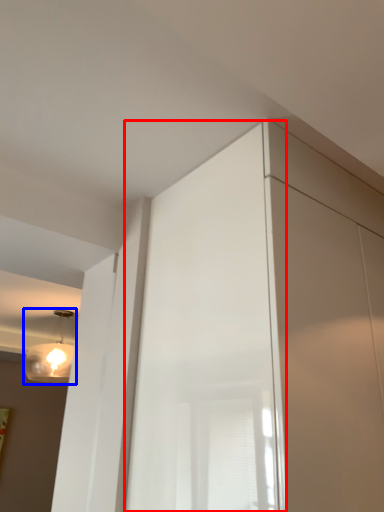
Question: Which of the following is the farthest to the observer, screen door (highlighted by a red box) or lamp (highlighted by a blue box)?

Choices:
 (A) screen door
 (B) lamp

Answer: (B)